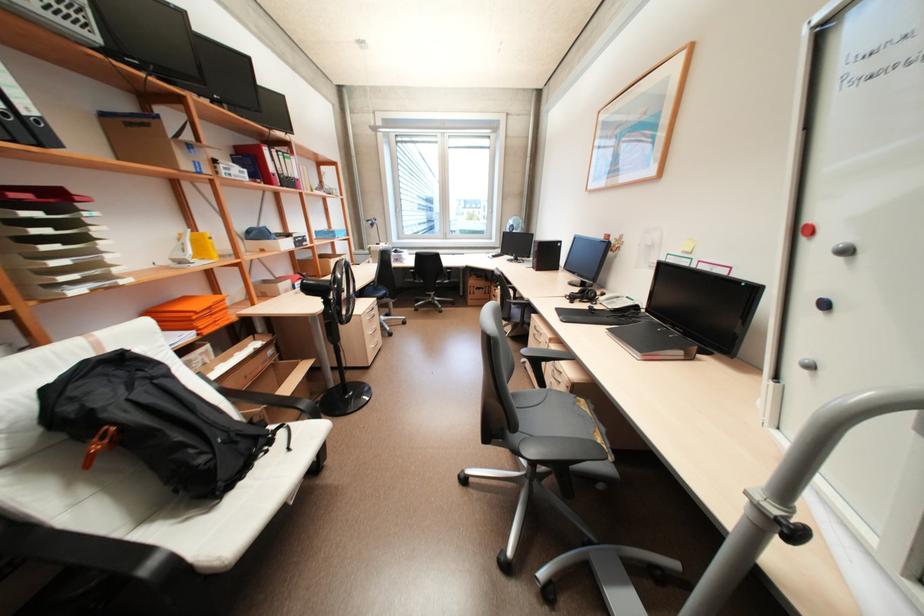
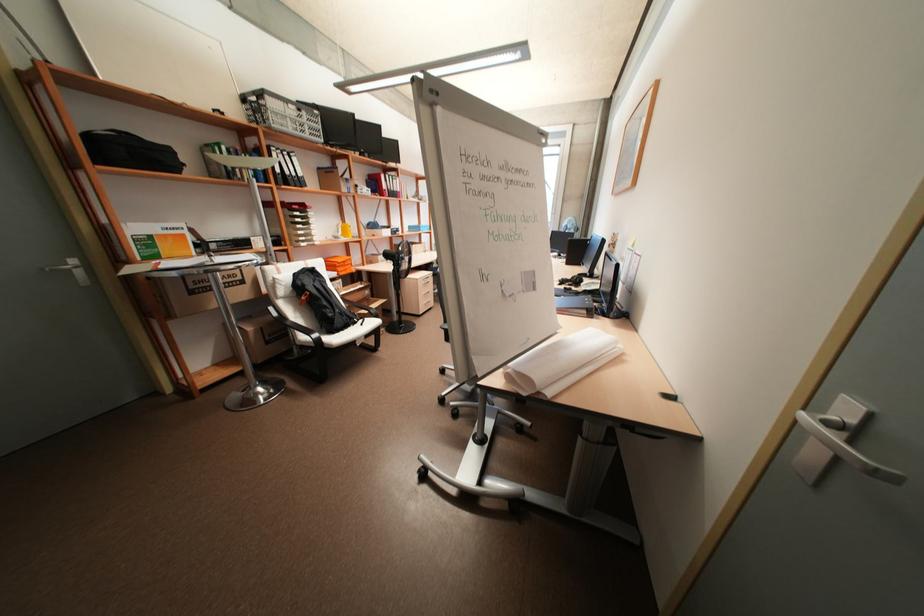
Based on the photo, the images are taken continuously from a first-person perspective. In which direction are you moving?

The cameraman moved toward right, backward.